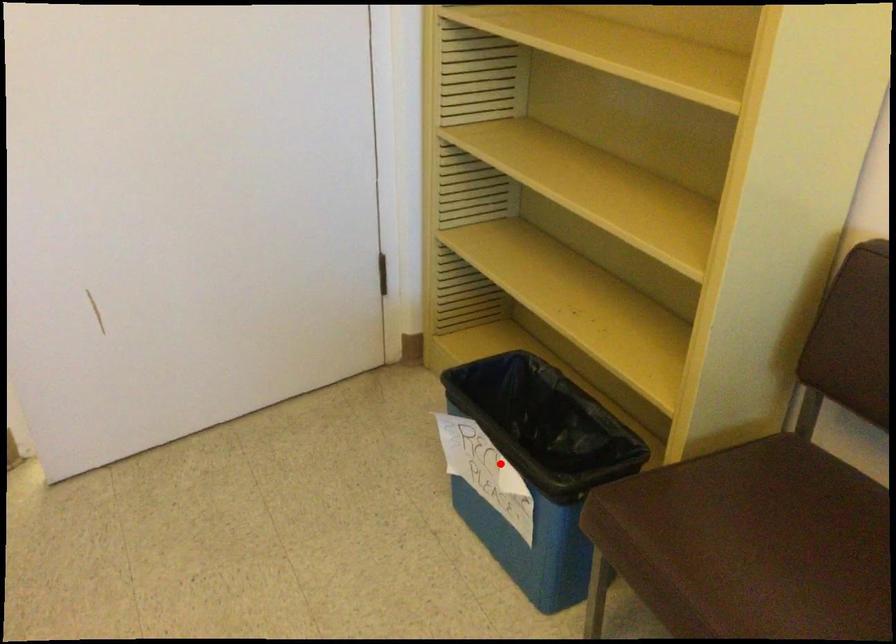
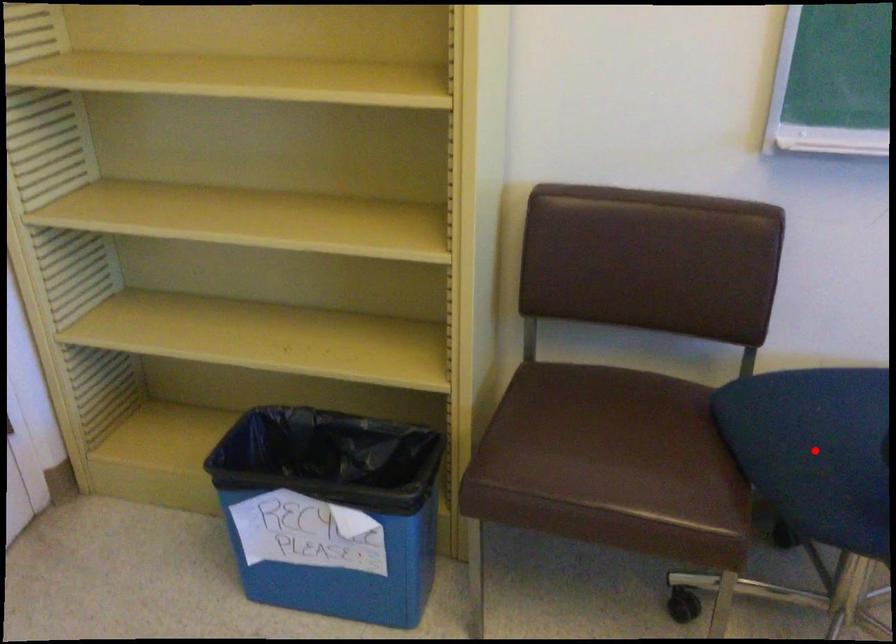
I am providing you with two images of the same scene from different viewpoints. A red point is marked on the first image and another point is marked on the second image. Are the points marked in image1 and image2 representing the same 3D position?

No